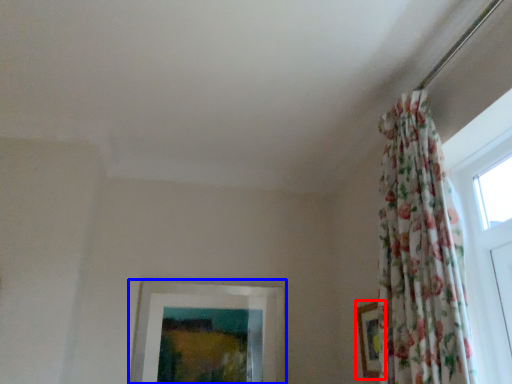
Question: Which object appears closest to the camera in this image, picture frame (highlighted by a red box) or picture frame (highlighted by a blue box)?

Choices:
 (A) picture frame
 (B) picture frame

Answer: (A)